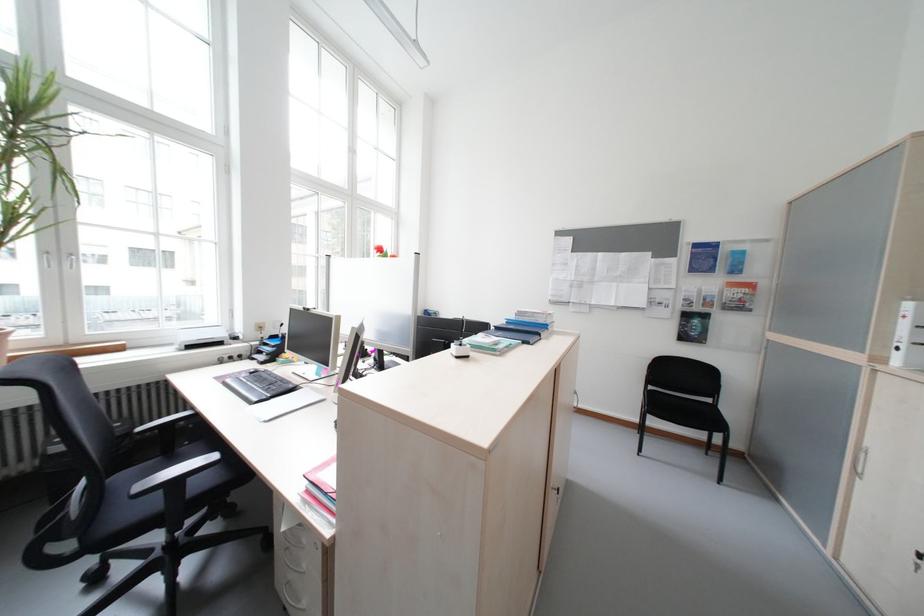
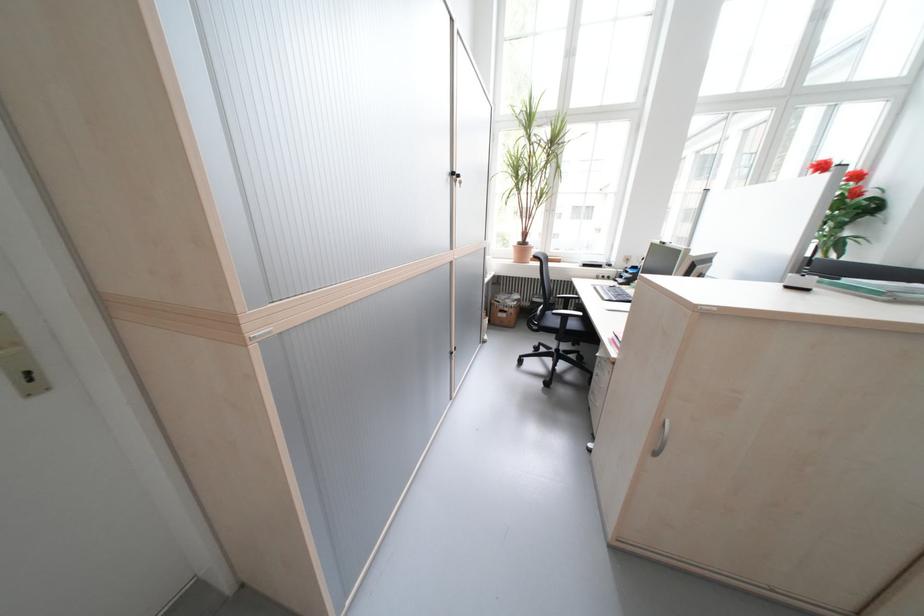
Where in the second image is the point corresponding to (256,355) from the first image?

(623, 278)